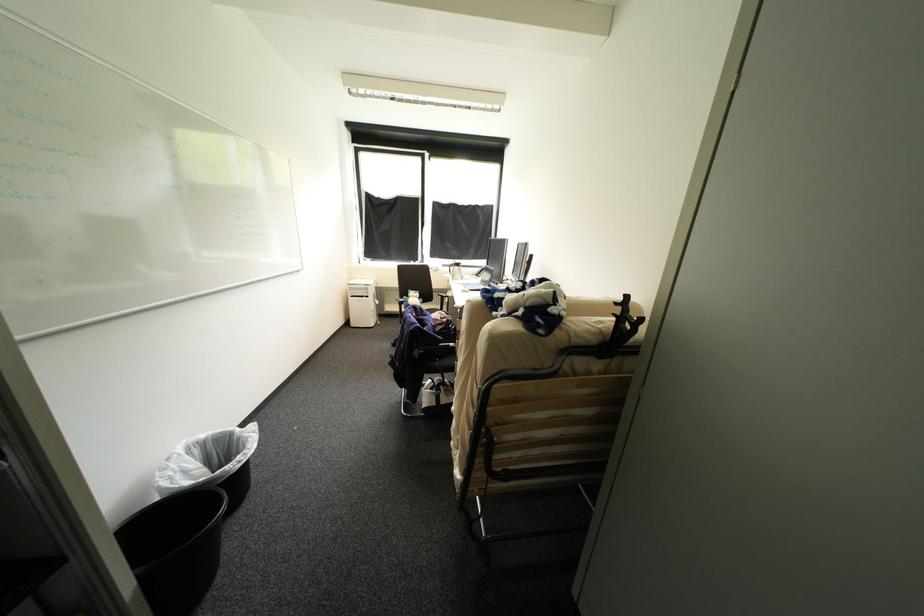
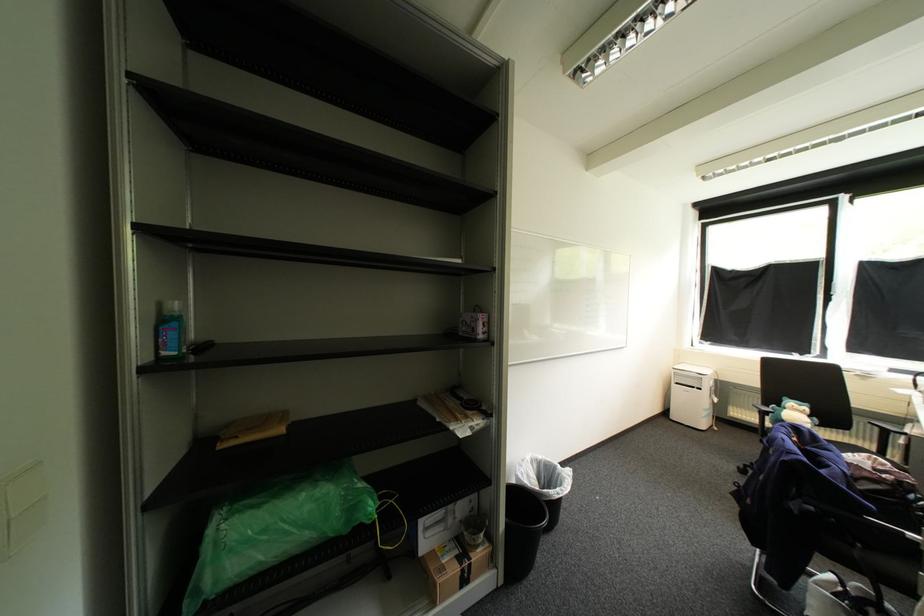
Question: Based on the continuous images, in which direction is the camera rotating? Reply with the corresponding letter.

Choices:
 (A) Left
 (B) Right
 (C) Up
 (D) Down

Answer: (A)